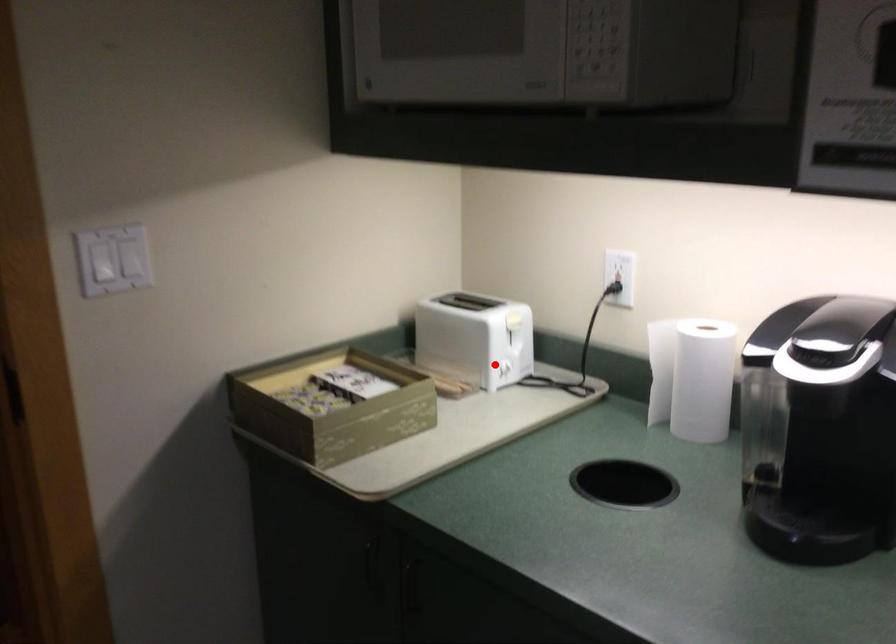
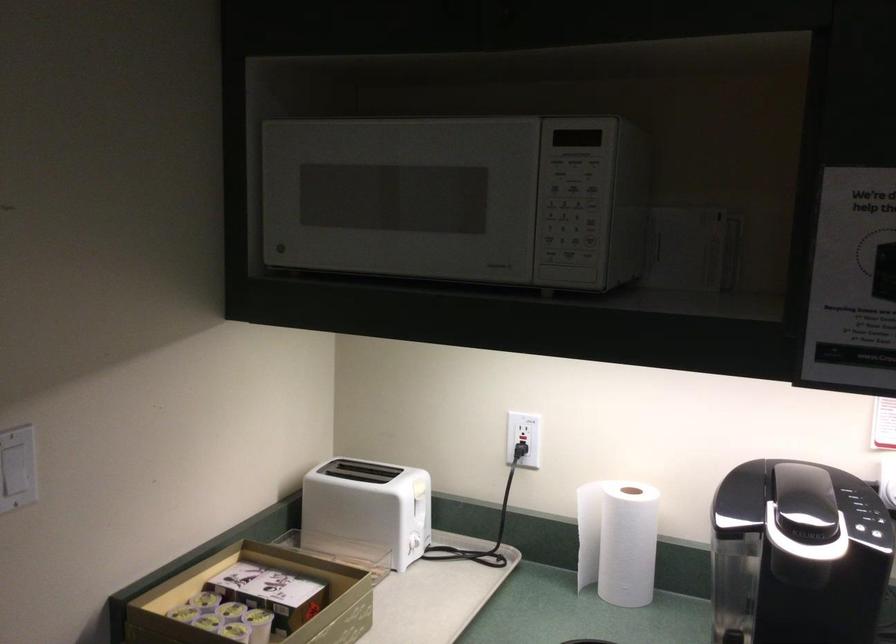
Locate, in the second image, the point that corresponds to the highlighted location in the first image.

(408, 542)